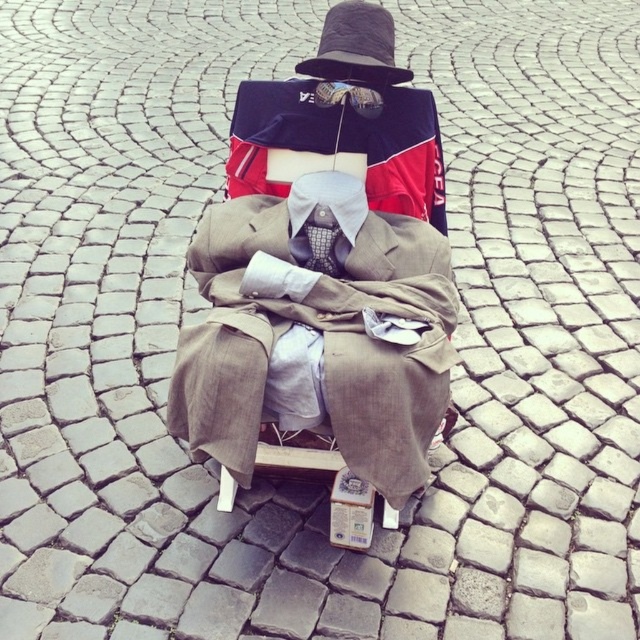
You are standing in a surreal cobblestone square and want to place a small flag at the point closer to you between the two points marked as point (435, 266) and point (317, 236). Which point should you choose?

You should choose point (435, 266) because it is closer to the camera than point (317, 236).